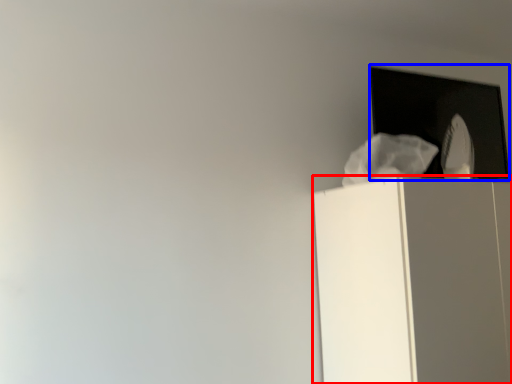
Question: Among these objects, which one is nearest to the camera, furniture (highlighted by a red box) or window (highlighted by a blue box)?

Choices:
 (A) furniture
 (B) window

Answer: (A)